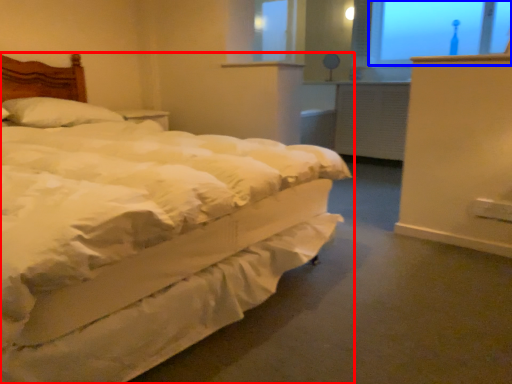
Question: Which point is closer to the camera, bed (highlighted by a red box) or window screen (highlighted by a blue box)?

Choices:
 (A) bed
 (B) window screen

Answer: (A)